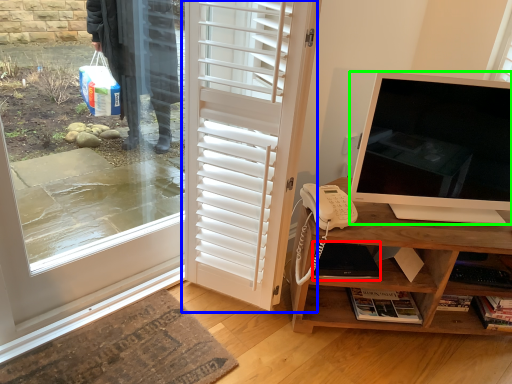
Question: Estimate the real-world distances between objects in this image. Which object is closer to laptop (highlighted by a red box), door (highlighted by a blue box) or television (highlighted by a green box)?

Choices:
 (A) door
 (B) television

Answer: (B)